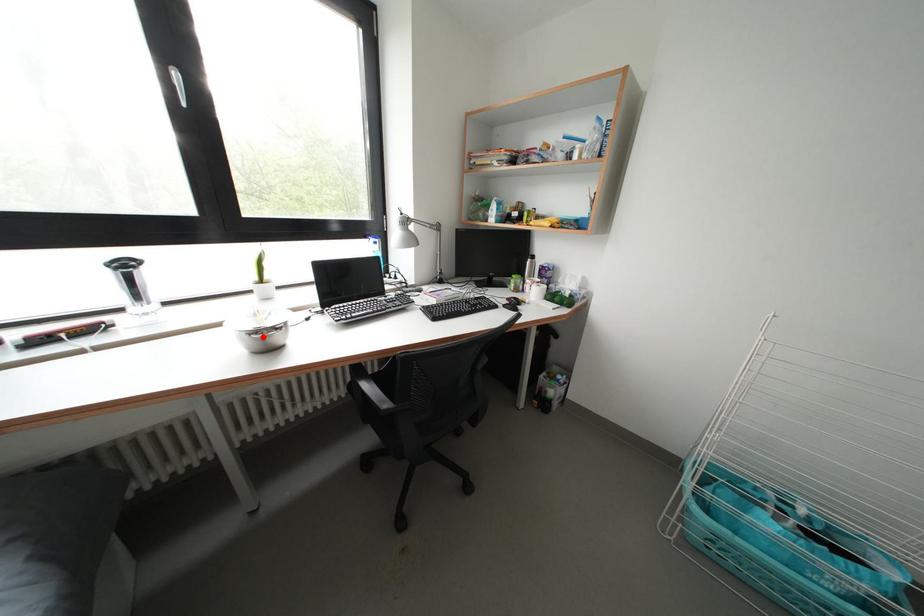
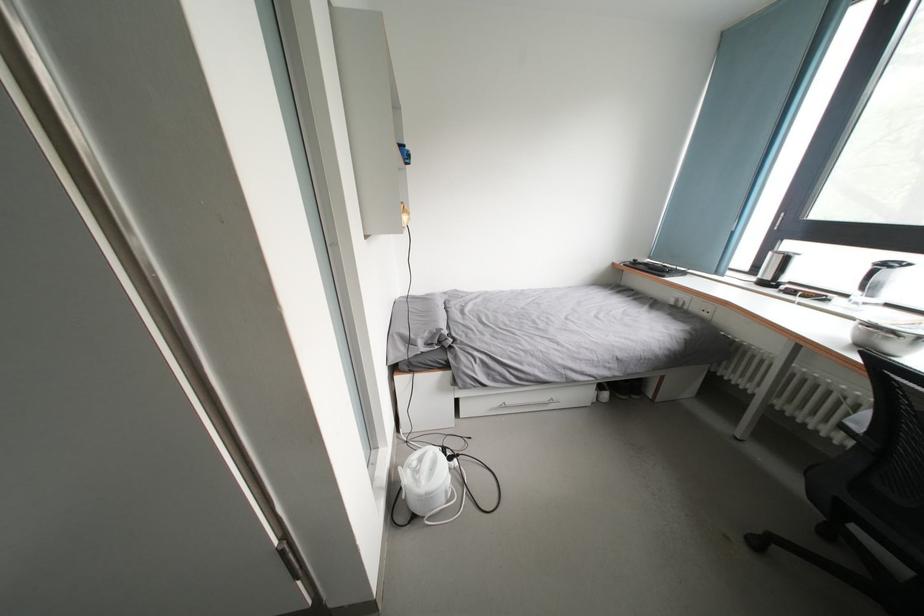
The point at the highlighted location is marked in the first image. Where is the corresponding point in the second image?

(877, 331)